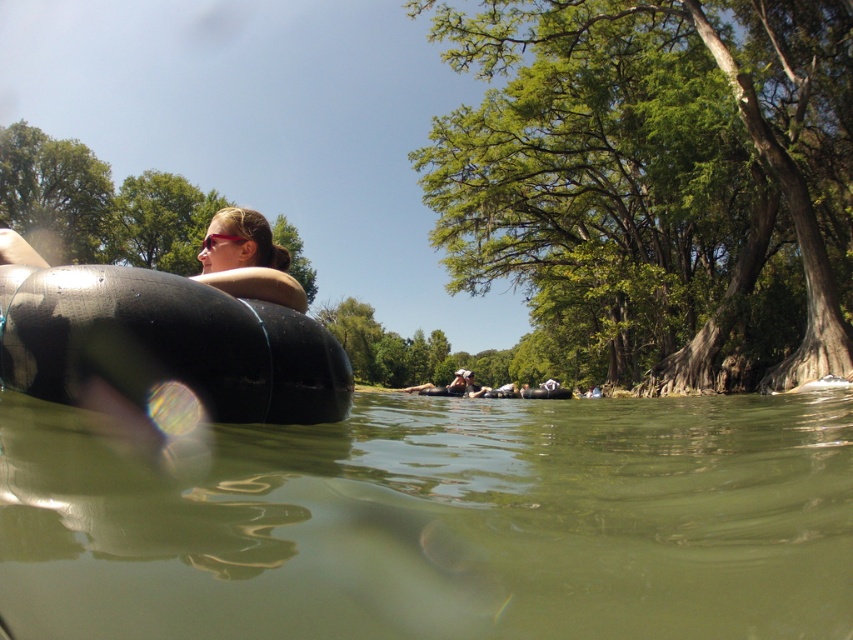
You are floating on an inner tube in the river and want to reach a point closer to you. There are two points marked in the image, point (84, 417) and point (233, 220). Which point should you aim for?

You should aim for point (84, 417) because it is closer to the viewer than point (233, 220).

You are planning to take a photo from the water surface. You have a camera that can capture a width of 3 meters. The green murky water at lower center and the black rubber tube at left are both in your view. Which object will occupy more space in your photo?

The green murky water at lower center occupies more space in the photo because its width is larger than that of the black rubber tube at left.